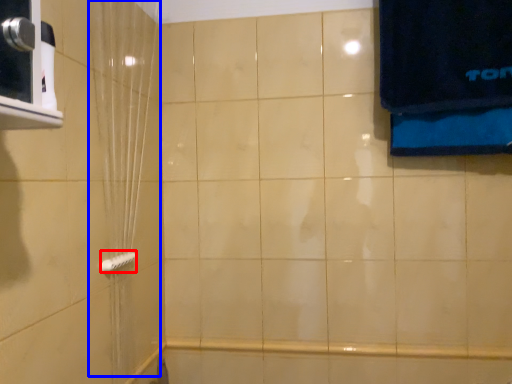
Question: Among these objects, which one is farthest to the camera, towel bar (highlighted by a red box) or shower curtain (highlighted by a blue box)?

Choices:
 (A) towel bar
 (B) shower curtain

Answer: (A)